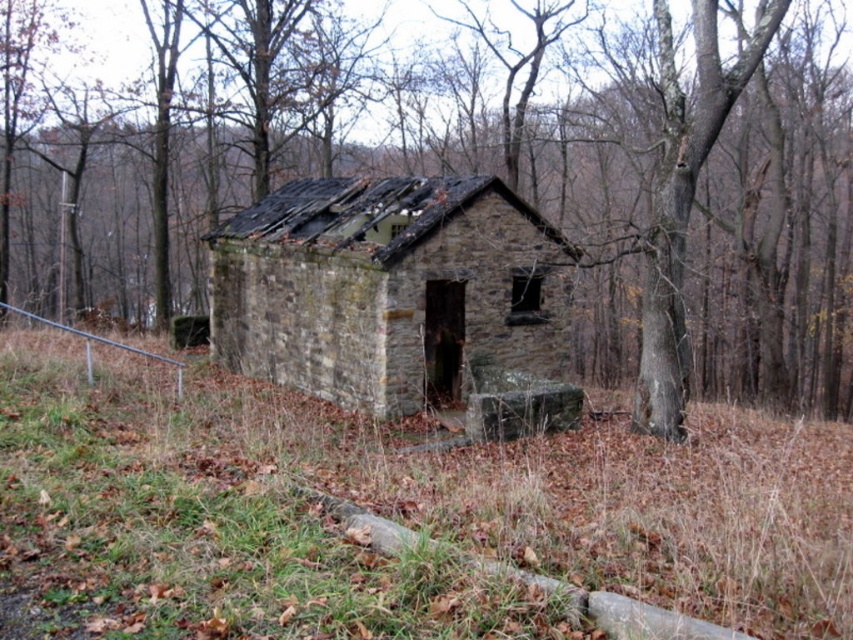
Is brown rough bark tree at center taller than rusty stone hut at center?

Correct, brown rough bark tree at center is much taller as rusty stone hut at center.

Image resolution: width=853 pixels, height=640 pixels. What do you see at coordinates (548, 232) in the screenshot?
I see `brown rough bark tree at center` at bounding box center [548, 232].

Identify the location of brown rough bark tree at center. (548, 232).